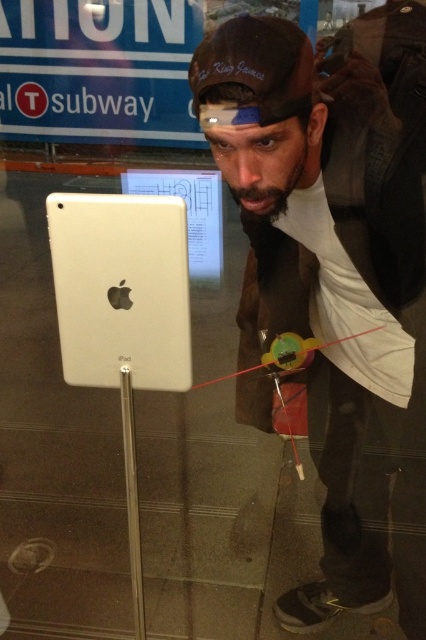
Is white matte ipad at center positioned before silver metallic pole at center?

Yes, white matte ipad at center is closer to the viewer.

The width and height of the screenshot is (426, 640). Identify the location of white matte ipad at center. (339, 269).

Does point (382, 225) lie in front of point (129, 470)?

Yes, it is.

The image size is (426, 640). Find the location of `white matte ipad at center`. white matte ipad at center is located at coordinates 339,269.

Does white matte ipad at center come behind green plastic toy at center?

No, white matte ipad at center is closer to the viewer.

Is white matte ipad at center closer to the viewer compared to green plastic toy at center?

Yes, it is in front of green plastic toy at center.

Who is more distant from viewer, (325, 186) or (287, 332)?

Point (287, 332)

Where is `white matte ipad at center`? This screenshot has height=640, width=426. white matte ipad at center is located at coordinates (339, 269).

Who is taller, silver metallic pole at center or green plastic toy at center?

With more height is silver metallic pole at center.

Does silver metallic pole at center have a larger size compared to green plastic toy at center?

Correct, silver metallic pole at center is larger in size than green plastic toy at center.

Who is more forward, (126, 426) or (218, 378)?

Point (126, 426)

Where is `silver metallic pole at center`? silver metallic pole at center is located at coordinates (132, 500).